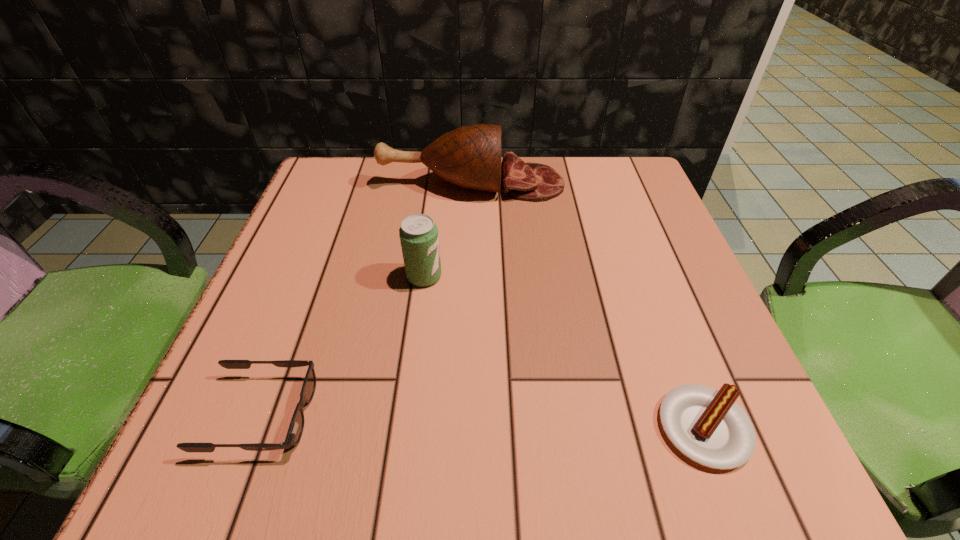
This screenshot has height=540, width=960. I want to click on vacant area between the rightmost object and the ham, so click(x=588, y=306).

Locate an element on the screen. vacant point located between the ham and the leftmost object is located at coordinates (367, 299).

Image resolution: width=960 pixels, height=540 pixels. I want to click on empty space between the ham and the soda, so click(x=448, y=230).

Find the location of `free spot between the leftmost object and the sausage`. free spot between the leftmost object and the sausage is located at coordinates (483, 421).

You are a GUI agent. You are given a task and a screenshot of the screen. Output one action in this format:
    pyautogui.click(x=<x>, y=<y>)
    Task: Click on the free space between the sunglasses and the ham
    Image resolution: width=960 pixels, height=540 pixels.
    Given the screenshot: What is the action you would take?
    pyautogui.click(x=367, y=299)

Locate an element on the screen. Image resolution: width=960 pixels, height=540 pixels. object that is the second closest to the farthest object is located at coordinates (295, 430).

Where is `object that stands as the closest to the leftmost object`? Image resolution: width=960 pixels, height=540 pixels. object that stands as the closest to the leftmost object is located at coordinates (418, 233).

You are a GUI agent. You are given a task and a screenshot of the screen. Output one action in this format:
    pyautogui.click(x=<x>, y=<y>)
    Task: Click on the free location that satisfies the following two spatial constraints: 1. at the sliced end of the ham; 2. on the left side of the shortest object
    
    Given the screenshot: What is the action you would take?
    coord(466,428)

Image resolution: width=960 pixels, height=540 pixels. What are the coordinates of `free region that satisfies the following two spatial constraints: 1. on the back side of the shortest object; 2. on the temples of the leftmost object` in the screenshot? It's located at tap(699, 414).

This screenshot has width=960, height=540. What are the coordinates of `blank space that satisfies the following two spatial constraints: 1. on the temples of the leftmost object; 2. on the right side of the rightmost object` in the screenshot? It's located at (256, 428).